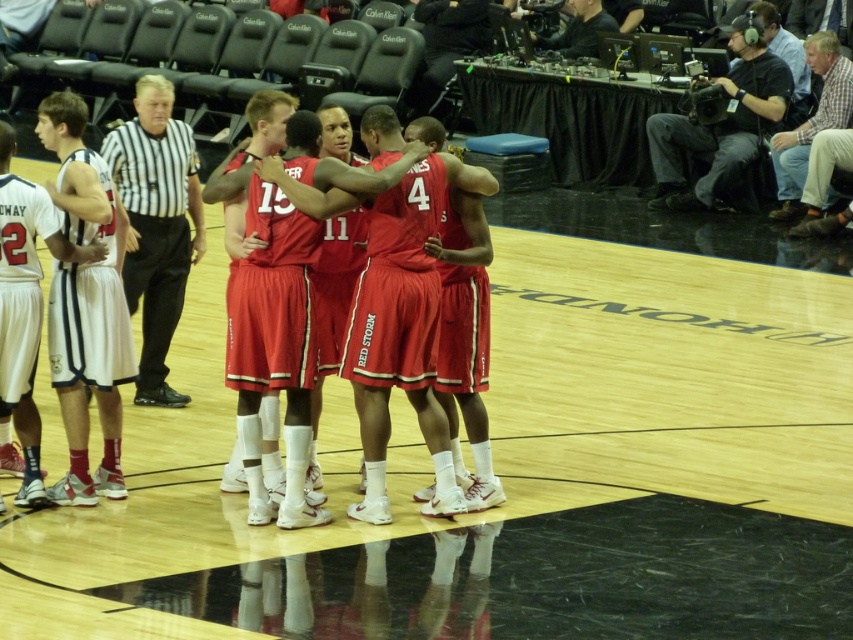
Question: Is white matte basketball guard at left below plaid shirt at upper right?

Choices:
 (A) yes
 (B) no

Answer: (A)

Question: Among these objects, which one is farthest from the camera?

Choices:
 (A) black striped shirt at upper left
 (B) plaid shirt at upper right

Answer: (A)

Question: Does plaid shirt at upper right appear under black matte camera at upper right?

Choices:
 (A) yes
 (B) no

Answer: (A)

Question: Which of these objects is positioned farthest from the black striped shirt at left?

Choices:
 (A) black matte camera at upper right
 (B) shiny red jersey at center
 (C) black striped shirt at upper left

Answer: (A)

Question: Is shiny red jersey at center to the left of black matte camera at upper right from the viewer's perspective?

Choices:
 (A) yes
 (B) no

Answer: (A)

Question: Which is farther from the black matte camera at upper right?

Choices:
 (A) black striped shirt at left
 (B) white matte basketball guard at left
 (C) black striped shirt at upper left

Answer: (B)